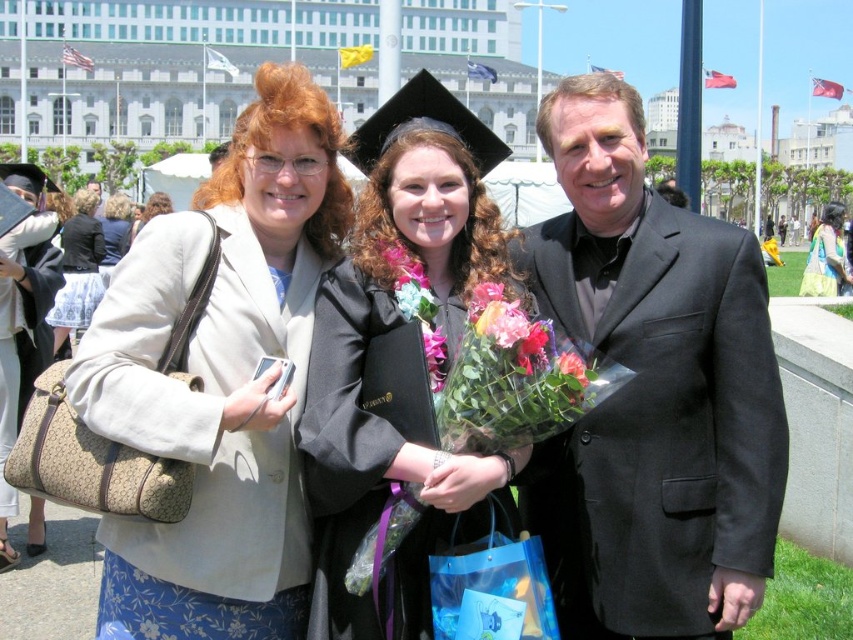
You are a photographer at a graduation ceremony. You need to position yourself so that the black suit at center and the light beige fabric purse at left are both visible in your frame. Based on their positions, which object should be placed on the right side of your camera view?

The black suit at center is to the right of the light beige fabric purse at left, so the black suit at center should be positioned on the right side of the camera view.

You are a photographer at the graduation ceremony. You want to capture a photo where the black suit at center and the floral lei at center are both clearly visible. Considering their sizes, which one should you focus on to ensure both are in frame?

The black suit at center is much taller than the floral lei at center, so focusing on the black suit at center will ensure both are in frame as the lei is smaller and positioned near it.